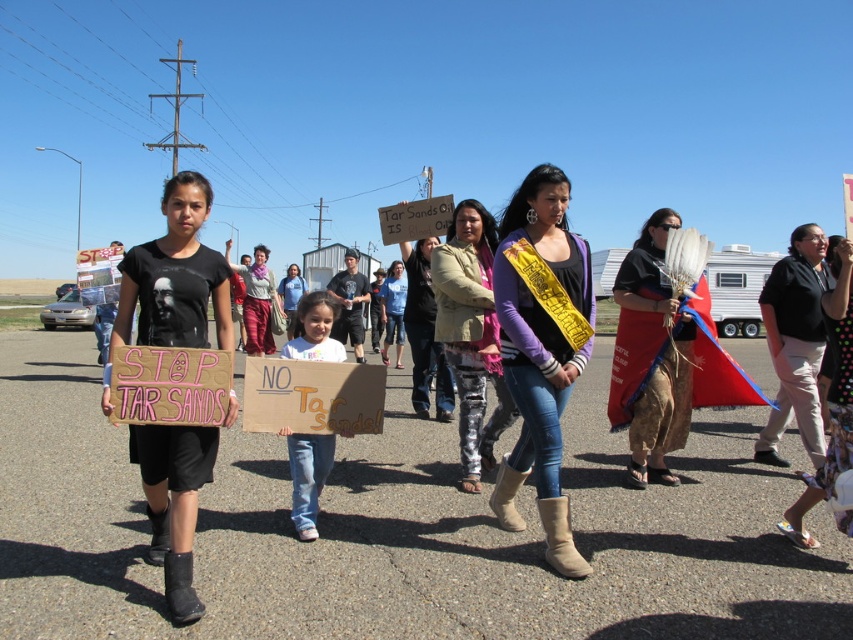
You are a photographer trying to capture a photo of the camouflage pants at center and the blue fabric headdress at right. Which object should you zoom in on to ensure both are in frame without moving the camera?

Since the camouflage pants at center is wider than the blue fabric headdress at right, you should zoom in on the camouflage pants at center to ensure both are in frame without moving the camera.

You are a photographer trying to capture a photo of the protest. You notice two participants wearing a matte purple sweater at center and camouflage pants at center. Which clothing item should you focus on if you want to highlight something smaller in the scene?

The matte purple sweater at center has a smaller size compared to the camouflage pants at center, so you should focus on the matte purple sweater at center to highlight something smaller in the scene.